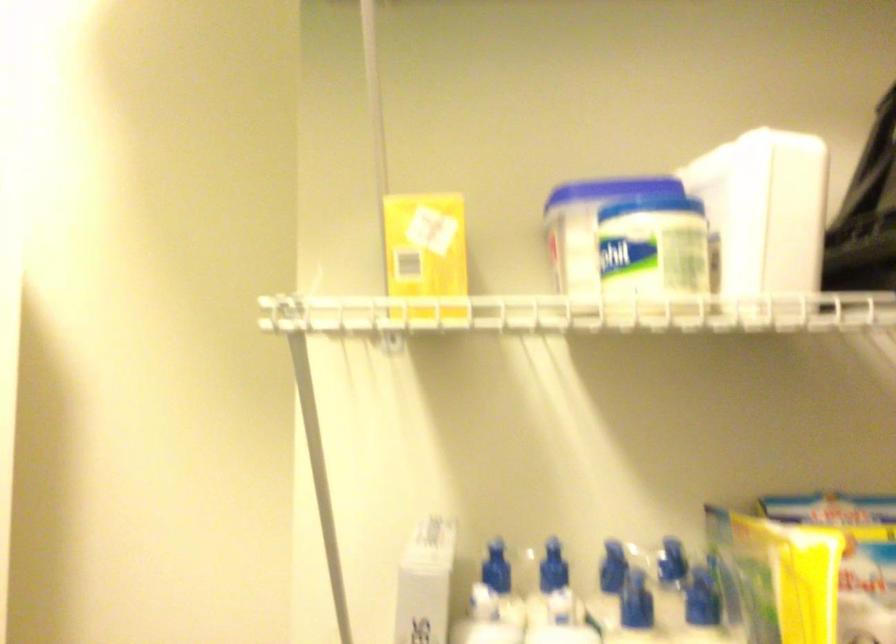
Question: How did the camera likely rotate?

Choices:
 (A) Left
 (B) Right
 (C) Up
 (D) Down

Answer: (A)